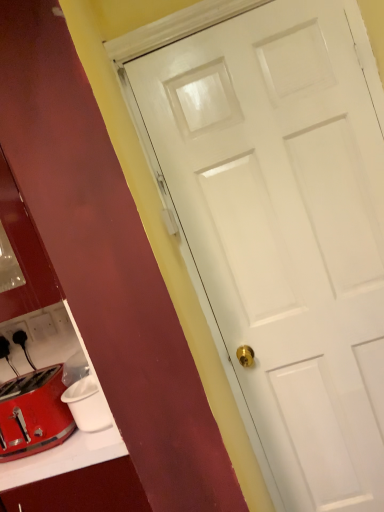
Question: From the image's perspective, does shiny metallic toaster at lower left appear lower than black plastic electric outlet at lower left, arranged as the 2th electric outlet when viewed from the right?

Choices:
 (A) yes
 (B) no

Answer: (A)

Question: From the image's perspective, does shiny metallic toaster at lower left appear higher than black plastic electric outlet at lower left, positioned as the 1th electric outlet in left-to-right order?

Choices:
 (A) yes
 (B) no

Answer: (B)

Question: Are shiny metallic toaster at lower left and black plastic electric outlet at lower left, positioned as the 1th electric outlet in left-to-right order, far apart?

Choices:
 (A) no
 (B) yes

Answer: (A)

Question: Can you see shiny metallic toaster at lower left touching black plastic electric outlet at lower left, arranged as the 2th electric outlet when viewed from the right?

Choices:
 (A) no
 (B) yes

Answer: (A)

Question: Considering the relative sizes of shiny metallic toaster at lower left and black plastic electric outlet at lower left, positioned as the 1th electric outlet in left-to-right order, in the image provided, is shiny metallic toaster at lower left bigger than black plastic electric outlet at lower left, positioned as the 1th electric outlet in left-to-right order,?

Choices:
 (A) yes
 (B) no

Answer: (A)

Question: From the image's perspective, is shiny metallic toaster at lower left above or below white plastic electric outlet at lower left, which is the second electric outlet from left to right?

Choices:
 (A) below
 (B) above

Answer: (A)

Question: Considering the positions of shiny metallic toaster at lower left and white plastic electric outlet at lower left, positioned as the first electric outlet in right-to-left order, in the image, is shiny metallic toaster at lower left wider or thinner than white plastic electric outlet at lower left, positioned as the first electric outlet in right-to-left order,?

Choices:
 (A) thin
 (B) wide

Answer: (B)

Question: Is shiny metallic toaster at lower left spatially inside white plastic electric outlet at lower left, which is the second electric outlet from left to right, or outside of it?

Choices:
 (A) outside
 (B) inside

Answer: (A)

Question: Looking at the image, does shiny metallic toaster at lower left seem bigger or smaller compared to white plastic electric outlet at lower left, positioned as the first electric outlet in right-to-left order?

Choices:
 (A) big
 (B) small

Answer: (A)

Question: From a real-world perspective, relative to shiny metallic toaster at lower left, is black plastic electric outlet at lower left, arranged as the 2th electric outlet when viewed from the right, vertically above or below?

Choices:
 (A) above
 (B) below

Answer: (A)

Question: Looking at their shapes, would you say black plastic electric outlet at lower left, arranged as the 2th electric outlet when viewed from the right, is wider or thinner than shiny metallic toaster at lower left?

Choices:
 (A) thin
 (B) wide

Answer: (A)

Question: In the image, is black plastic electric outlet at lower left, positioned as the 1th electric outlet in left-to-right order, on the left side or the right side of shiny metallic toaster at lower left?

Choices:
 (A) right
 (B) left

Answer: (B)

Question: Relative to shiny metallic toaster at lower left, is black plastic electric outlet at lower left, positioned as the 1th electric outlet in left-to-right order, in front or behind?

Choices:
 (A) behind
 (B) front

Answer: (A)

Question: Considering their positions, is white plastic electric outlet at lower left, which is the second electric outlet from left to right, located in front of or behind shiny metallic toaster at lower left?

Choices:
 (A) behind
 (B) front

Answer: (A)

Question: Is white plastic electric outlet at lower left, which is the second electric outlet from left to right, situated inside shiny metallic toaster at lower left or outside?

Choices:
 (A) outside
 (B) inside

Answer: (A)